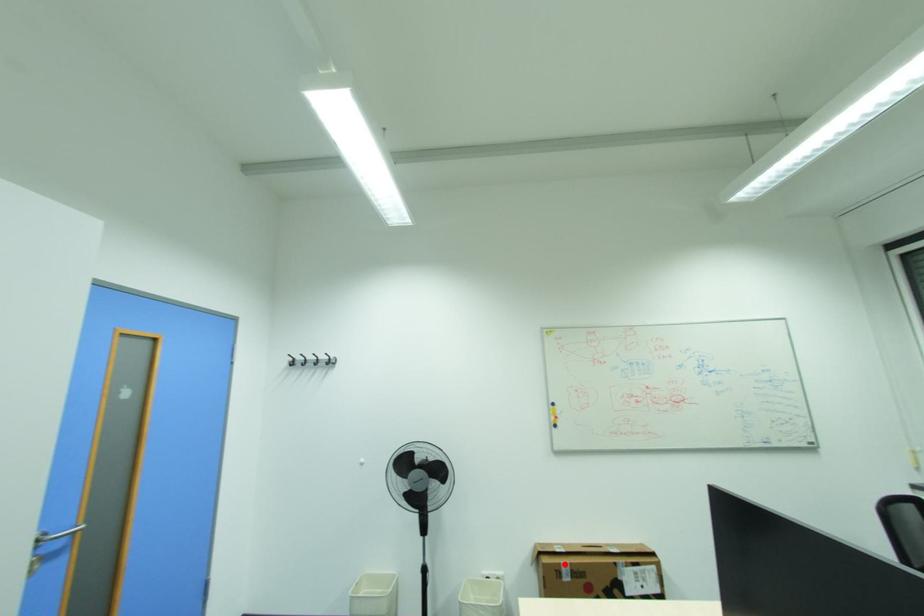
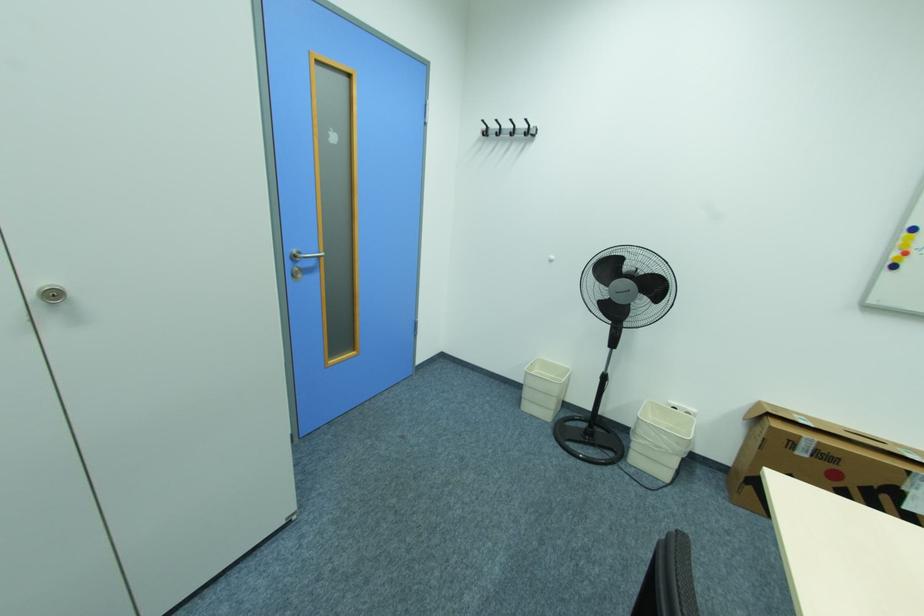
Question: I am providing you with two images of the same scene from different viewpoints. A red point is marked on the first image. Is the red point's position out of view in image 2?

Choices:
 (A) Yes
 (B) No

Answer: (B)